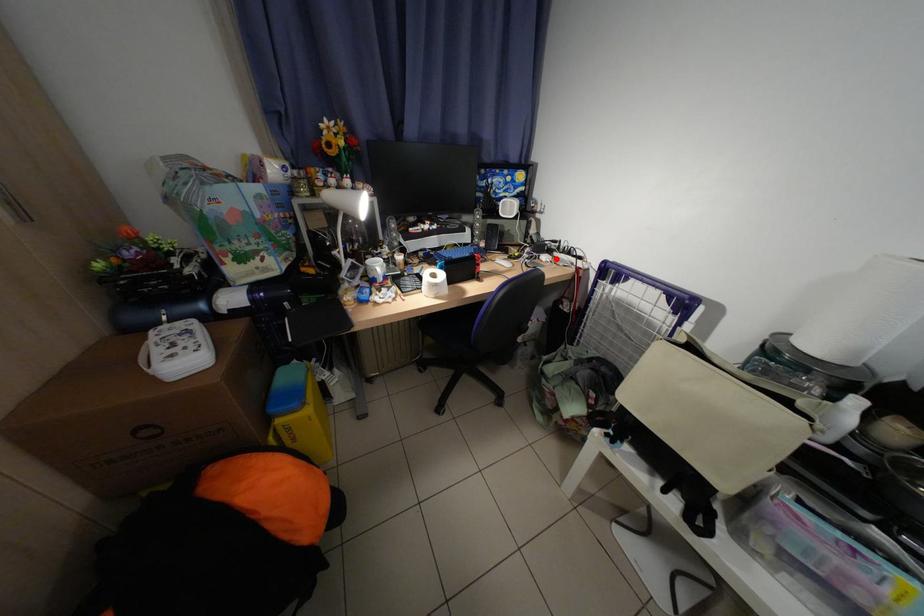
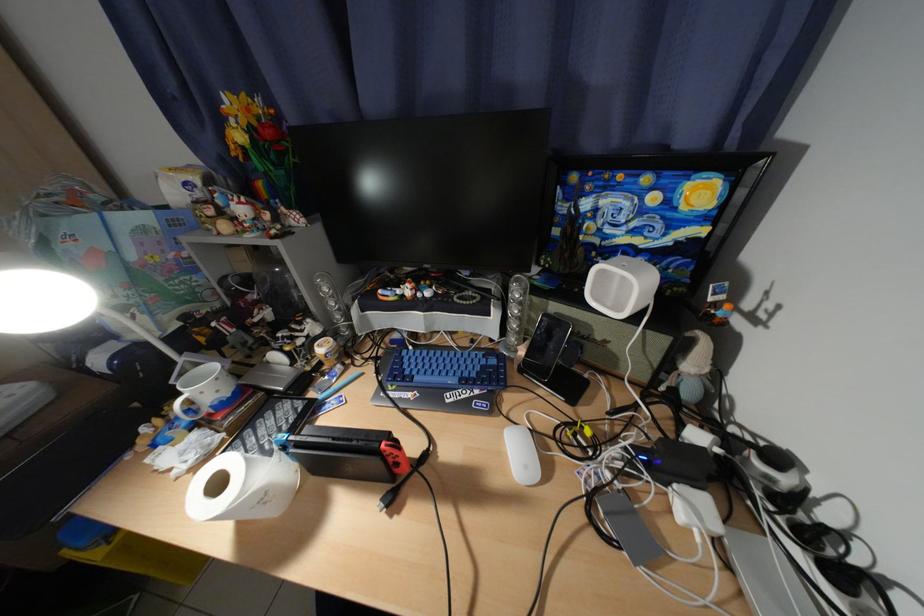
The point at the highlighted location is marked in the first image. Where is the corresponding point in the second image?

(700, 508)